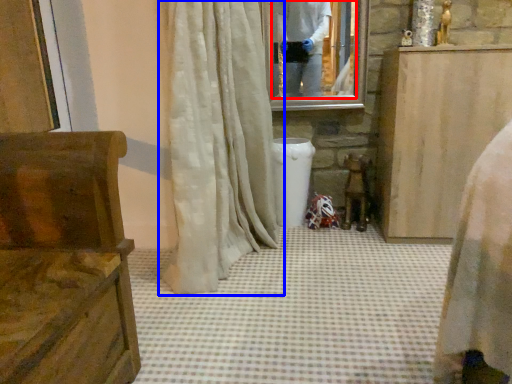
Question: Which point is closer to the camera, mirror (highlighted by a red box) or curtain (highlighted by a blue box)?

Choices:
 (A) mirror
 (B) curtain

Answer: (B)